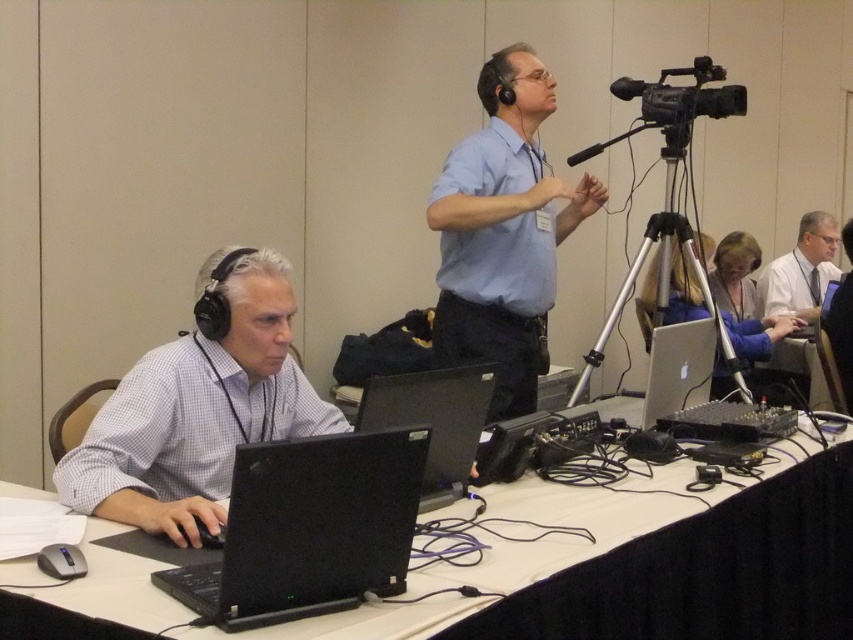
Question: Which object appears farthest from the camera in this image?

Choices:
 (A) silver/black laptop at center
 (B) light blue shirt at center

Answer: (B)

Question: Which of the following is the farthest from the observer?

Choices:
 (A) (587, 362)
 (B) (291, 593)

Answer: (A)

Question: Does black plastic table at lower left appear on the left side of light blue shirt at center?

Choices:
 (A) no
 (B) yes

Answer: (A)

Question: Which object is positioned closest to the black matte microphone at upper center?

Choices:
 (A) black plastic table at lower left
 (B) silver metallic tripod at center
 (C) matte black laptop at left

Answer: (B)

Question: Observing the image, what is the correct spatial positioning of white shirt at upper right in reference to black matte microphone at upper center?

Choices:
 (A) above
 (B) below

Answer: (B)

Question: Does matte black laptop at left have a lesser width compared to black plastic video camera at upper right?

Choices:
 (A) yes
 (B) no

Answer: (A)